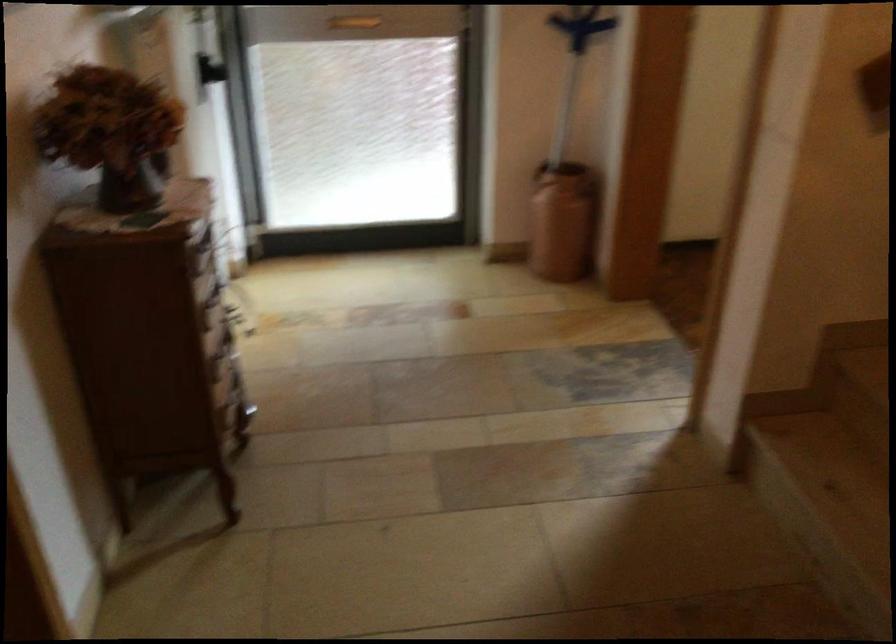
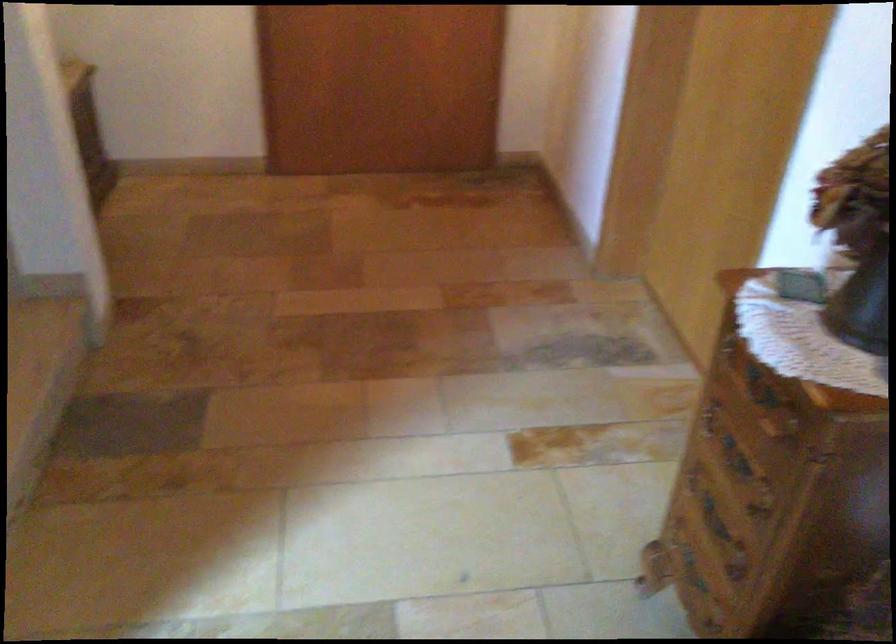
Find the pixel in the second image that matches (x=205, y=345) in the first image.

(735, 457)